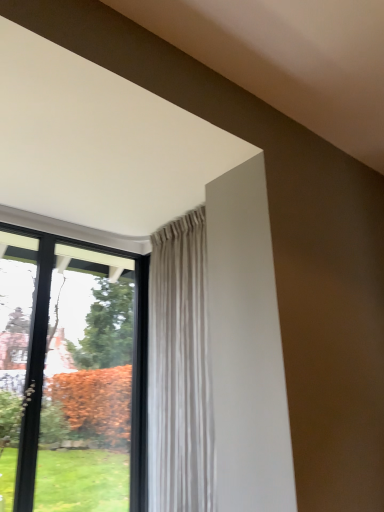
This screenshot has width=384, height=512. What do you see at coordinates (72, 376) in the screenshot? I see `black glass window at left` at bounding box center [72, 376].

Measure the distance between point (22,296) and camera.

The depth of point (22,296) is 7.77 feet.

Locate an element on the screen. This screenshot has height=512, width=384. black glass window at left is located at coordinates (72, 376).

In order to face black glass window at left, should I rotate leftwards or rightwards?

To align with it, rotate left about 15.489°.

What do you see at coordinates (180, 370) in the screenshot? The image size is (384, 512). I see `beige textured curtain at upper center` at bounding box center [180, 370].

In order to click on beige textured curtain at upper center in this screenshot , I will do `click(180, 370)`.

Identify the location of black glass window at left. The width and height of the screenshot is (384, 512). (72, 376).

Which object is positioned more to the right, black glass window at left or beige textured curtain at upper center?

beige textured curtain at upper center is more to the right.

Considering their positions, is black glass window at left located in front of or behind beige textured curtain at upper center?

Visually, black glass window at left is located behind beige textured curtain at upper center.

Which is farther, (16, 408) or (197, 334)?

The point (16, 408) is farther.

From the image's perspective, which is below, black glass window at left or beige textured curtain at upper center?

black glass window at left is shown below in the image.

From a real-world perspective, is black glass window at left physically located above or below beige textured curtain at upper center?

From a real-world perspective, black glass window at left is physically below beige textured curtain at upper center.

Considering the relative sizes of black glass window at left and beige textured curtain at upper center in the image provided, is black glass window at left wider than beige textured curtain at upper center?

In fact, black glass window at left might be narrower than beige textured curtain at upper center.

Consider the image. Who is shorter, black glass window at left or beige textured curtain at upper center?

black glass window at left is shorter.

Considering the relative sizes of black glass window at left and beige textured curtain at upper center in the image provided, is black glass window at left smaller than beige textured curtain at upper center?

Correct, black glass window at left occupies less space than beige textured curtain at upper center.

Is black glass window at left positioned beyond the bounds of beige textured curtain at upper center?

Yes, black glass window at left is not within beige textured curtain at upper center.

Is black glass window at left with beige textured curtain at upper center?

black glass window at left is not next to beige textured curtain at upper center, and they're not touching.

Is black glass window at left facing away from beige textured curtain at upper center?

No, black glass window at left's orientation is not away from beige textured curtain at upper center.

This screenshot has height=512, width=384. Find the location of `window located underneath the beige textured curtain at upper center (from a real-world perspective)`. window located underneath the beige textured curtain at upper center (from a real-world perspective) is located at coordinates (72, 376).

Would you say beige textured curtain at upper center is to the left or to the right of black glass window at left in the picture?

Clearly, beige textured curtain at upper center is on the right of black glass window at left in the image.

Which object is further away from the camera, beige textured curtain at upper center or black glass window at left?

black glass window at left is more distant.

Is point (202, 364) closer to camera compared to point (92, 452)?

Yes, point (202, 364) is closer to viewer.

From the image's perspective, who appears lower, beige textured curtain at upper center or black glass window at left?

black glass window at left is shown below in the image.

From a real-world perspective, is beige textured curtain at upper center physically located above or below black glass window at left?

From a real-world perspective, beige textured curtain at upper center is physically above black glass window at left.

Which of these two, beige textured curtain at upper center or black glass window at left, is wider?

With larger width is beige textured curtain at upper center.

Considering the relative sizes of beige textured curtain at upper center and black glass window at left in the image provided, is beige textured curtain at upper center shorter than black glass window at left?

In fact, beige textured curtain at upper center may be taller than black glass window at left.

Who is smaller, beige textured curtain at upper center or black glass window at left?

black glass window at left.

Is black glass window at left completely or partially inside beige textured curtain at upper center?

No, black glass window at left is located outside of beige textured curtain at upper center.

Is beige textured curtain at upper center placed right next to black glass window at left?

No.

Is beige textured curtain at upper center facing away from black glass window at left?

beige textured curtain at upper center does not have its back to black glass window at left.

Based on the photo, measure the distance between beige textured curtain at upper center and black glass window at left.

beige textured curtain at upper center is 48.71 centimeters away from black glass window at left.

Identify the location of window that appears on the left of beige textured curtain at upper center. The width and height of the screenshot is (384, 512). (72, 376).

This screenshot has height=512, width=384. Identify the location of curtain above the black glass window at left (from a real-world perspective). (180, 370).

Image resolution: width=384 pixels, height=512 pixels. I want to click on window below the beige textured curtain at upper center (from the image's perspective), so click(x=72, y=376).